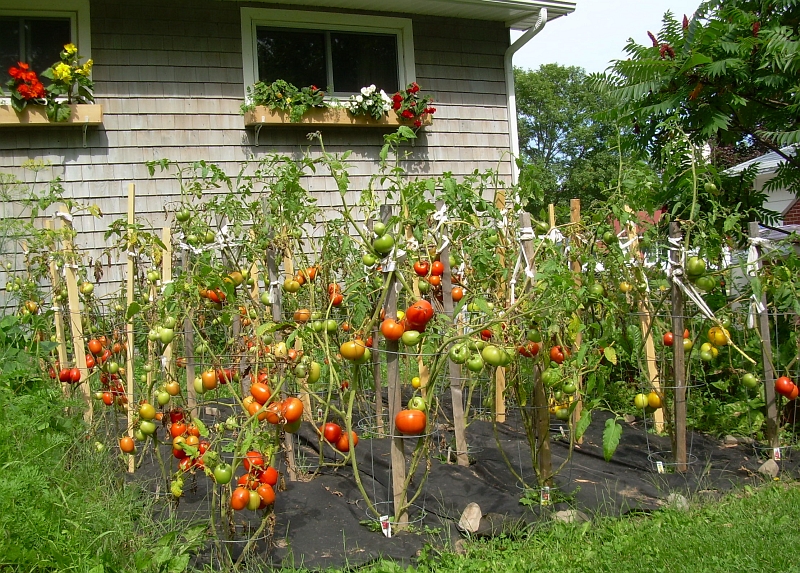
Image resolution: width=800 pixels, height=573 pixels. What are the coordinates of `plants in flower boxes` in the screenshot? It's located at (286, 87), (370, 96), (412, 100), (77, 81), (30, 96).